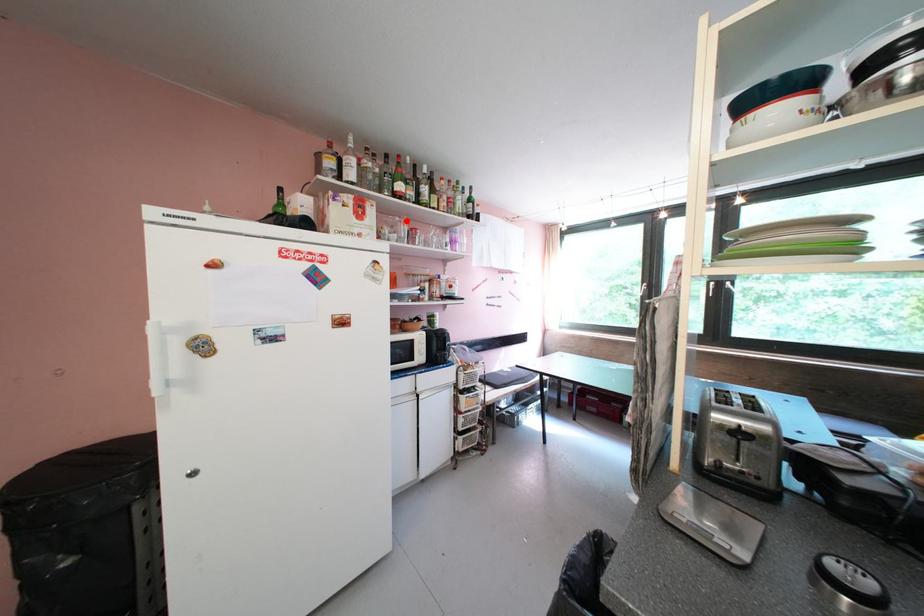
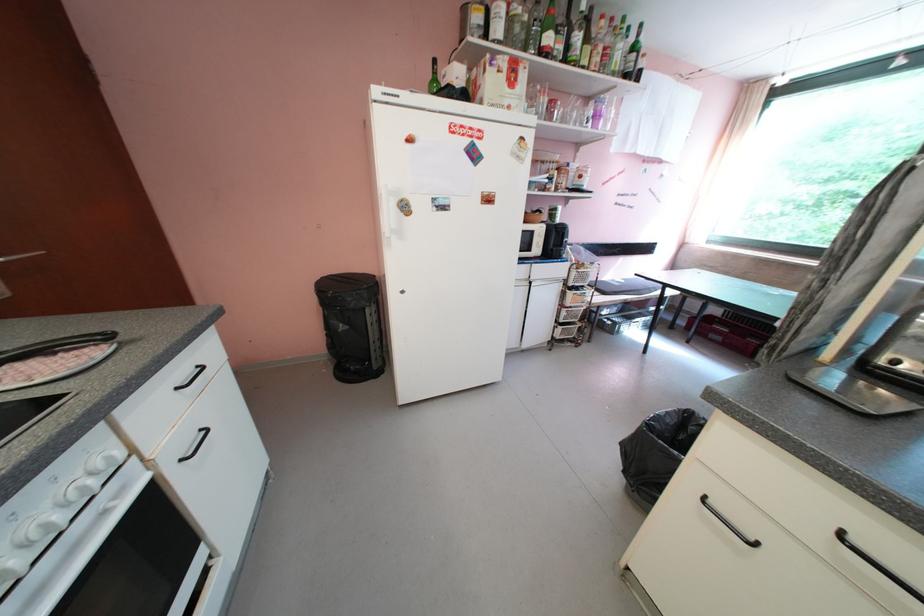
In the second image, find the point that corresponds to the highlighted location in the first image.

(546, 90)